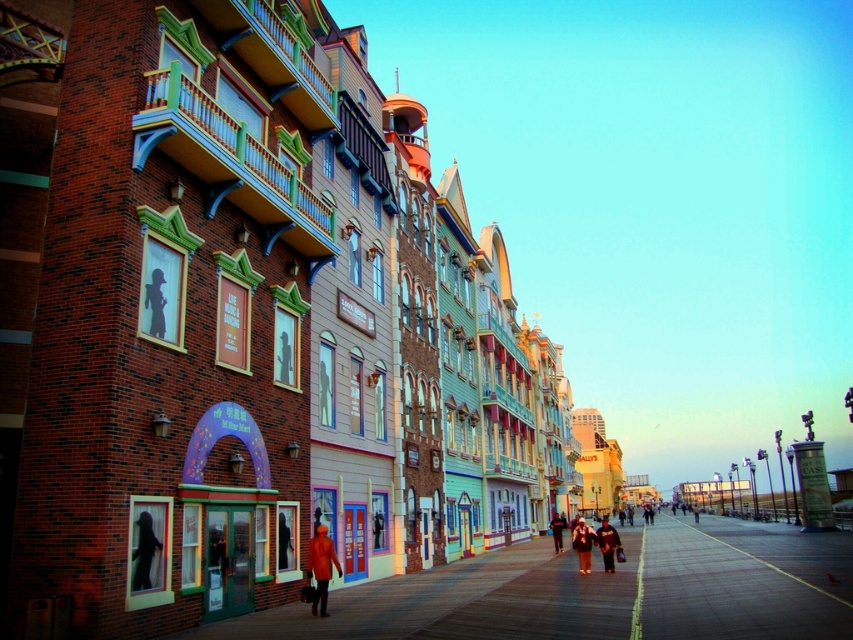
Which is more to the left, orange fabric coat at center or orange fabric jacket at center?

orange fabric coat at center

Between point (583, 534) and point (601, 541), which one is positioned behind?

The point (583, 534) is behind.

Which is behind, point (579, 547) or point (602, 561)?

The point (602, 561) is behind.

Where is `orange fabric coat at center`? Image resolution: width=853 pixels, height=640 pixels. orange fabric coat at center is located at coordinates (582, 545).

Does point (155, 545) come behind point (556, 545)?

That is False.

Is silhouette figure at center wider than orange jacket at center?

No, silhouette figure at center is not wider than orange jacket at center.

Between point (146, 522) and point (556, 536), which one is positioned in front?

Point (146, 522)

You are a GUI agent. You are given a task and a screenshot of the screen. Output one action in this format:
    pyautogui.click(x=<x>, y=<y>)
    Task: Click on the silhouette figure at center
    Image resolution: width=853 pixels, height=640 pixels.
    Given the screenshot: What is the action you would take?
    pyautogui.click(x=143, y=552)

Is point (366, 620) positioned behind point (146, 552)?

Yes, point (366, 620) is farther from viewer.

Who is shorter, wooden boardwalk at center or silhouette figure at center?

silhouette figure at center

Between point (842, 612) and point (140, 520), which one is positioned behind?

Point (842, 612)

The width and height of the screenshot is (853, 640). I want to click on wooden boardwalk at center, so click(x=598, y=592).